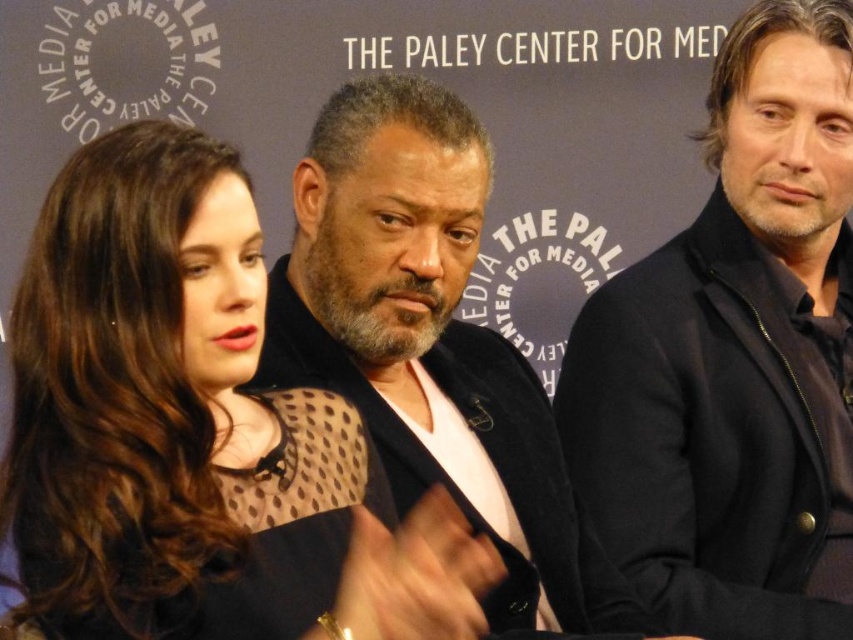
From the picture: How much distance is there between matte black dress at center and black wool jacket at right?

11.51 meters

Is point (48, 561) positioned in front of point (718, 547)?

Yes, it is.

Locate an element on the screen. This screenshot has width=853, height=640. matte black dress at center is located at coordinates (195, 433).

Does matte black dress at center have a greater width compared to black matte suit at center?

Correct, the width of matte black dress at center exceeds that of black matte suit at center.

Which is more to the right, matte black dress at center or black matte suit at center?

From the viewer's perspective, black matte suit at center appears more on the right side.

Is point (318, 584) positioned before point (543, 525)?

Yes, point (318, 584) is closer to viewer.

The height and width of the screenshot is (640, 853). I want to click on matte black dress at center, so click(x=195, y=433).

Does black wool jacket at right appear on the right side of black matte suit at center?

Yes, black wool jacket at right is to the right of black matte suit at center.

Is the position of black wool jacket at right less distant than that of black matte suit at center?

That is False.

Is point (811, 556) positioned after point (316, 358)?

Yes, it is behind point (316, 358).

Locate an element on the screen. The height and width of the screenshot is (640, 853). black wool jacket at right is located at coordinates (735, 356).